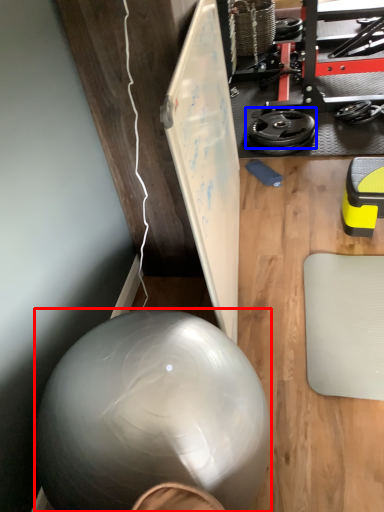
Question: Which point is closer to the camera, ball (highlighted by a red box) or wheel (highlighted by a blue box)?

Choices:
 (A) ball
 (B) wheel

Answer: (A)